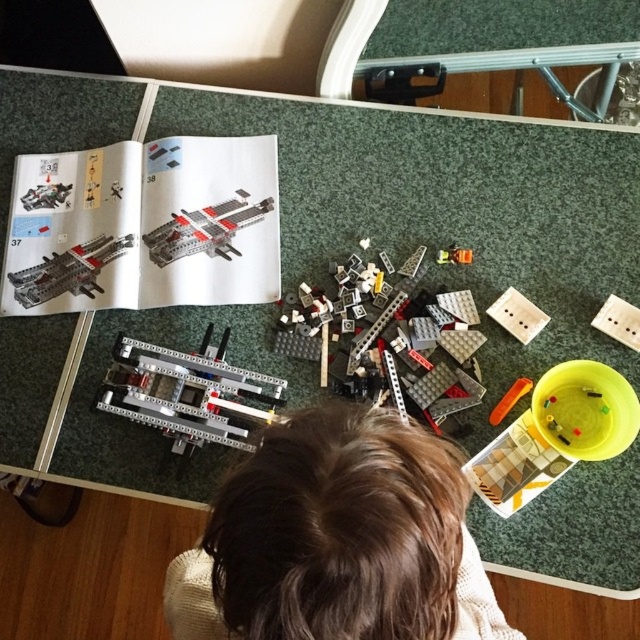
Question: Does white plastic plate at upper right lie in front of matte black spaceship at upper left?

Choices:
 (A) yes
 (B) no

Answer: (A)

Question: Among these objects, which one is farthest from the camera?

Choices:
 (A) matte black spaceship at upper left
 (B) white plastic plate at upper right
 (C) silver metallic lego set at center

Answer: (A)

Question: Estimate the real-world distances between objects in this image. Which object is farther from the translucent plastic spaceship at upper center?

Choices:
 (A) matte black plastic space shuttle at upper left
 (B) translucent plastic bricks at center
 (C) matte black spaceship at upper left

Answer: (C)

Question: Which of the following is the closest to the observer?

Choices:
 (A) translucent plastic bricks at center
 (B) translucent plastic spaceship at upper center
 (C) matte black spaceship at upper left

Answer: (A)

Question: Is the position of translucent yellow bowl at lower right less distant than that of matte black spaceship at upper left?

Choices:
 (A) yes
 (B) no

Answer: (A)

Question: Is translucent plastic spaceship at upper center positioned in front of matte black spaceship at upper left?

Choices:
 (A) yes
 (B) no

Answer: (A)